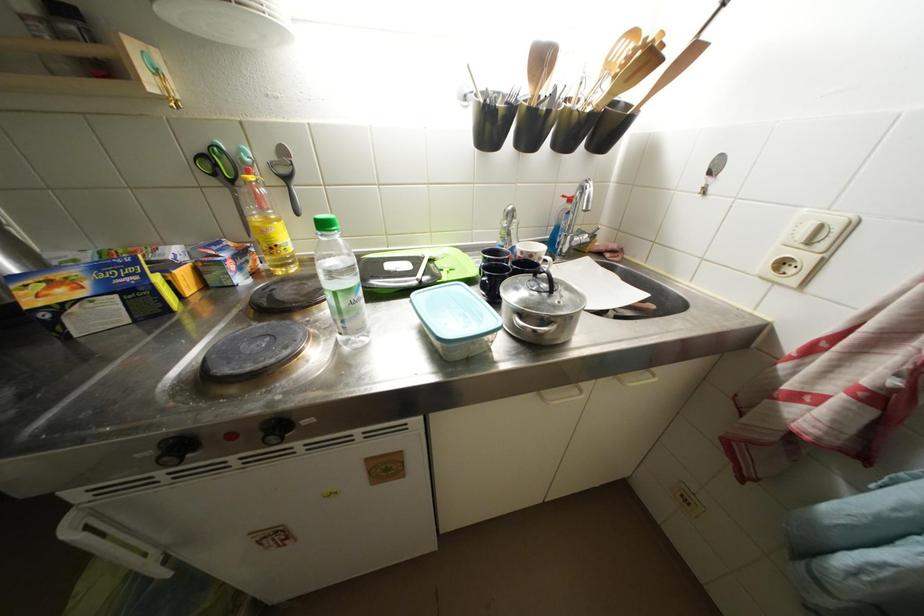
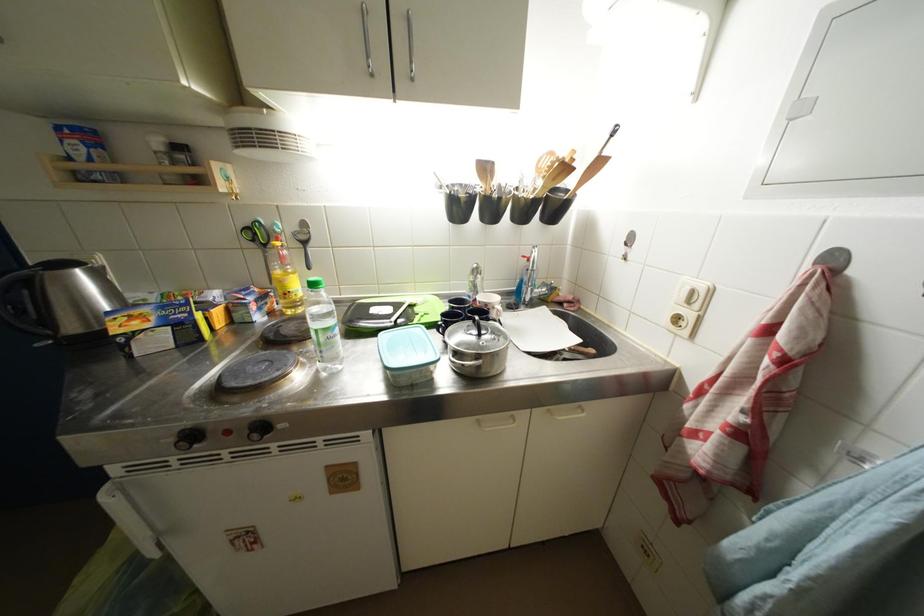
Where in the second image is the point corresponding to the point at 515,257 from the first image?

(477, 307)